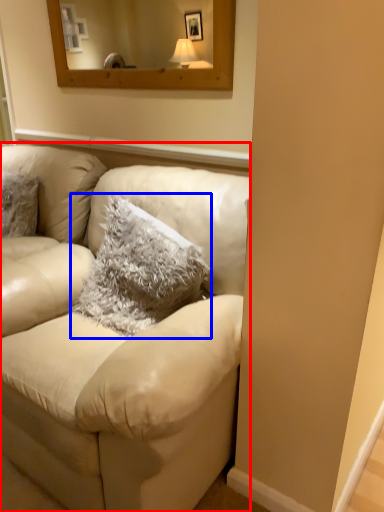
Question: Which object appears closest to the camera in this image, studio couch (highlighted by a red box) or pillow (highlighted by a blue box)?

Choices:
 (A) studio couch
 (B) pillow

Answer: (A)